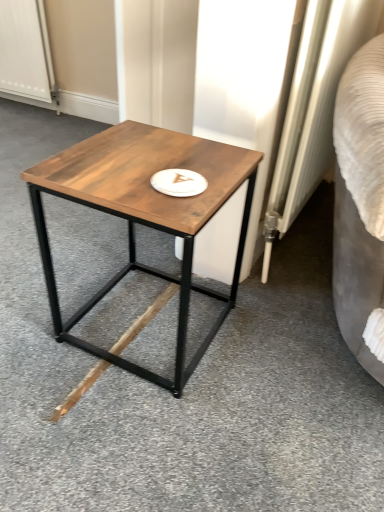
At what (x,y) coordinates should I click in order to perform the action: click on blank space above wooden table at center (from a real-world perspective). Please return your answer as a coordinate pair (x, y). This screenshot has height=512, width=384. Looking at the image, I should click on (147, 159).